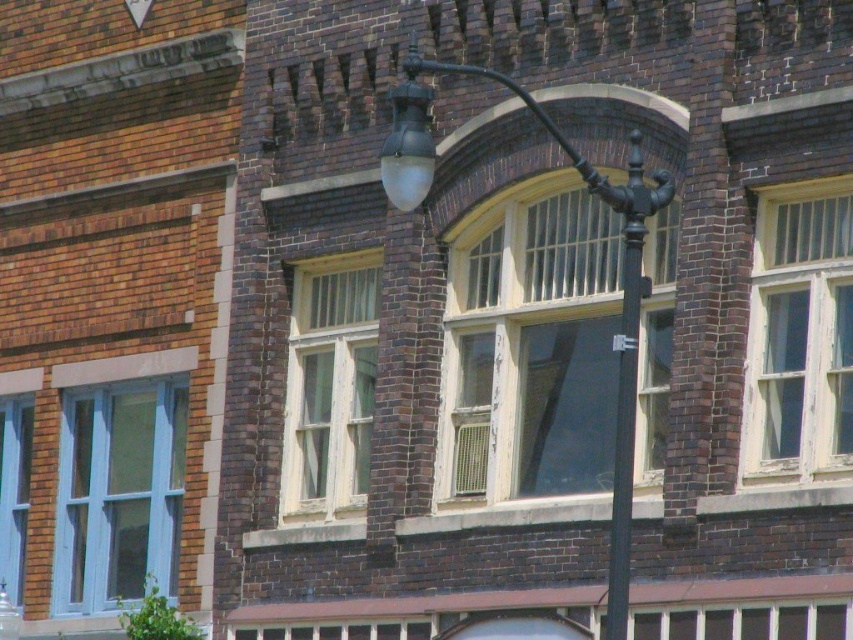
Question: Which point is closer to the camera?

Choices:
 (A) matte black street light at center
 (B) clear glass window at center
 (C) brown brick sign at upper left

Answer: (A)

Question: Can you confirm if white wooden window at right is bigger than matte black street light at center?

Choices:
 (A) yes
 (B) no

Answer: (B)

Question: Among these objects, which one is farthest from the camera?

Choices:
 (A) black metal pole at center
 (B) brown brick sign at upper left
 (C) light blue glass window at left
 (D) blue painted wood window at left

Answer: (C)

Question: Can you confirm if blue painted wood window at left is positioned above light blue glass window at left?

Choices:
 (A) no
 (B) yes

Answer: (B)

Question: Can you confirm if clear glass window at center is bigger than light blue glass window at left?

Choices:
 (A) no
 (B) yes

Answer: (A)

Question: Which of the following is the farthest from the observer?

Choices:
 (A) (61, 428)
 (B) (10, 506)

Answer: (B)